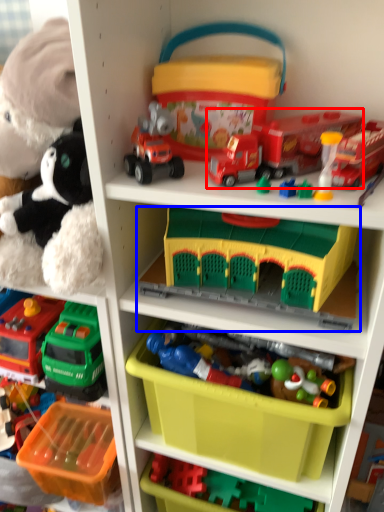
Question: Which object is closer to the camera taking this photo, toy (highlighted by a red box) or toy (highlighted by a blue box)?

Choices:
 (A) toy
 (B) toy

Answer: (A)